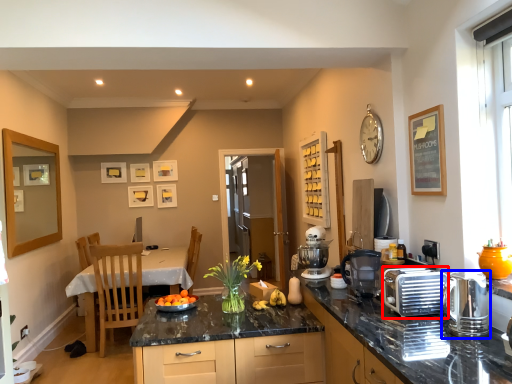
Question: Which of the following is the farthest to the observer, appliance (highlighted by a red box) or kitchen appliance (highlighted by a blue box)?

Choices:
 (A) appliance
 (B) kitchen appliance

Answer: (A)